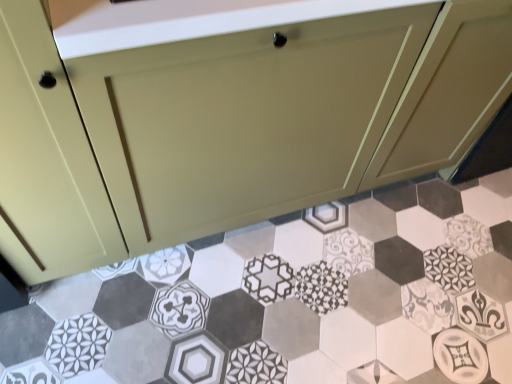
Question: From a real-world perspective, is patterned ceramic hexagon at center under matte cream cabinet at center?

Choices:
 (A) yes
 (B) no

Answer: (A)

Question: Considering the relative sizes of patterned ceramic hexagon at center and matte cream cabinet at center in the image provided, is patterned ceramic hexagon at center taller than matte cream cabinet at center?

Choices:
 (A) yes
 (B) no

Answer: (B)

Question: Is patterned ceramic hexagon at center surrounding matte cream cabinet at center?

Choices:
 (A) no
 (B) yes

Answer: (A)

Question: Does patterned ceramic hexagon at center appear on the right side of matte cream cabinet at center?

Choices:
 (A) no
 (B) yes

Answer: (B)

Question: Is patterned ceramic hexagon at center positioned with its back to matte cream cabinet at center?

Choices:
 (A) no
 (B) yes

Answer: (A)

Question: Is patterned ceramic hexagon at center oriented towards matte cream cabinet at center?

Choices:
 (A) yes
 (B) no

Answer: (B)

Question: Is matte cream cabinet at center not near patterned ceramic hexagon at center?

Choices:
 (A) yes
 (B) no

Answer: (B)

Question: Is matte cream cabinet at center wider than patterned ceramic hexagon at center?

Choices:
 (A) no
 (B) yes

Answer: (A)

Question: Is patterned ceramic hexagon at center inside matte cream cabinet at center?

Choices:
 (A) yes
 (B) no

Answer: (B)

Question: Can you confirm if matte cream cabinet at center is taller than patterned ceramic hexagon at center?

Choices:
 (A) no
 (B) yes

Answer: (B)

Question: Does matte cream cabinet at center have a larger size compared to patterned ceramic hexagon at center?

Choices:
 (A) no
 (B) yes

Answer: (B)

Question: Is matte cream cabinet at center facing towards patterned ceramic hexagon at center?

Choices:
 (A) yes
 (B) no

Answer: (A)

Question: In the image, is patterned ceramic hexagon at center positioned in front of or behind matte cream cabinet at center?

Choices:
 (A) behind
 (B) front

Answer: (A)